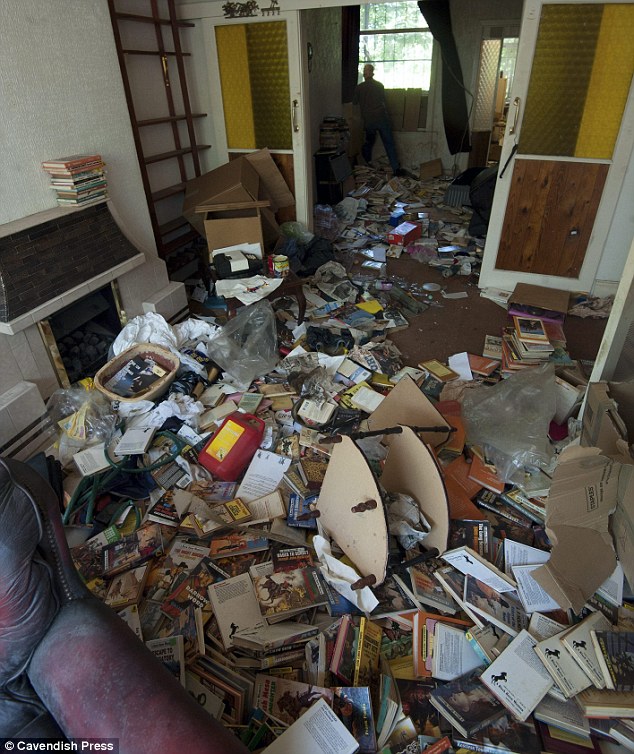
At what (x,y) coordinates should I click in order to perform the action: click on coffee table. Please return your answer as a coordinate pair (x, y). The image size is (634, 754). Looking at the image, I should click on (359, 537).